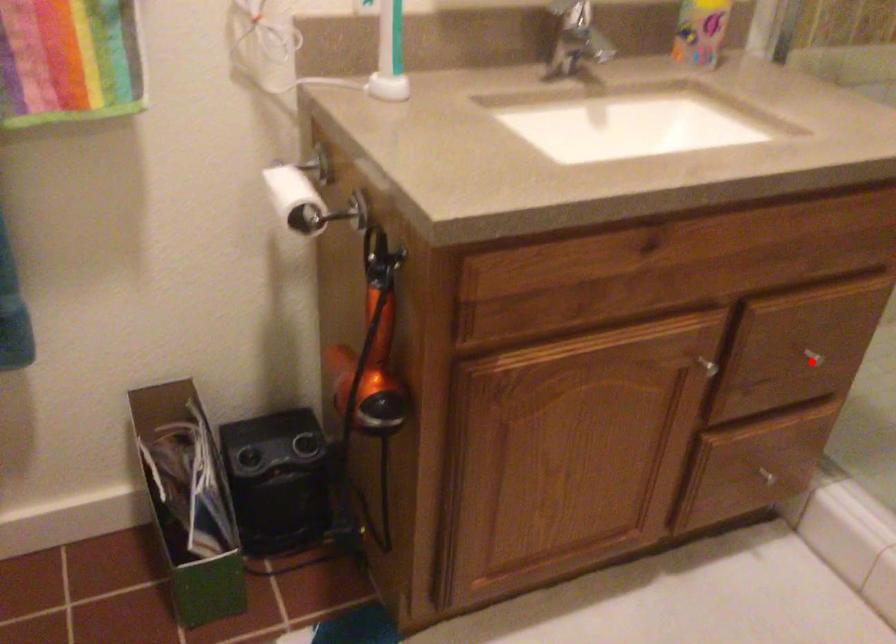
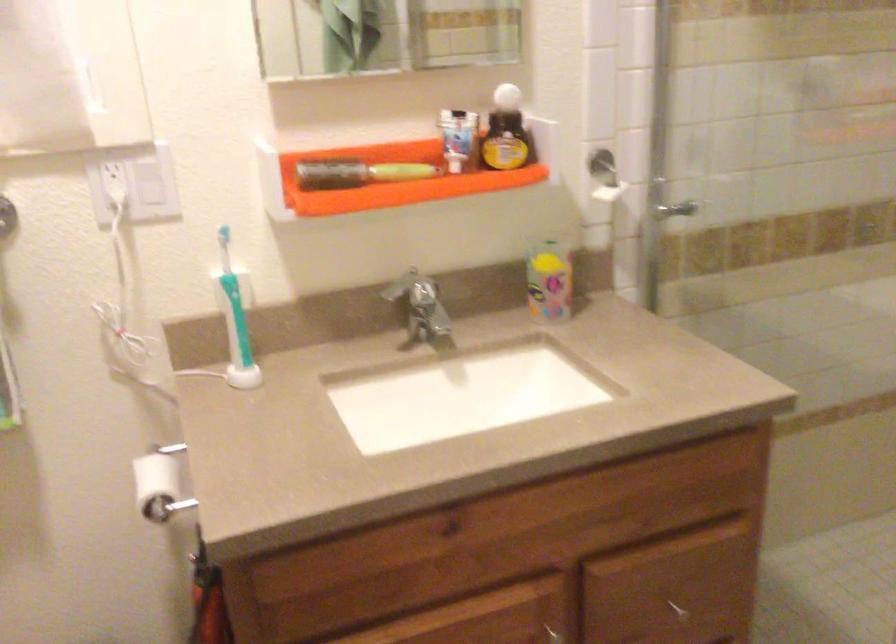
Where in the second image is the point corresponding to the highlighted location from the first image?

(677, 609)